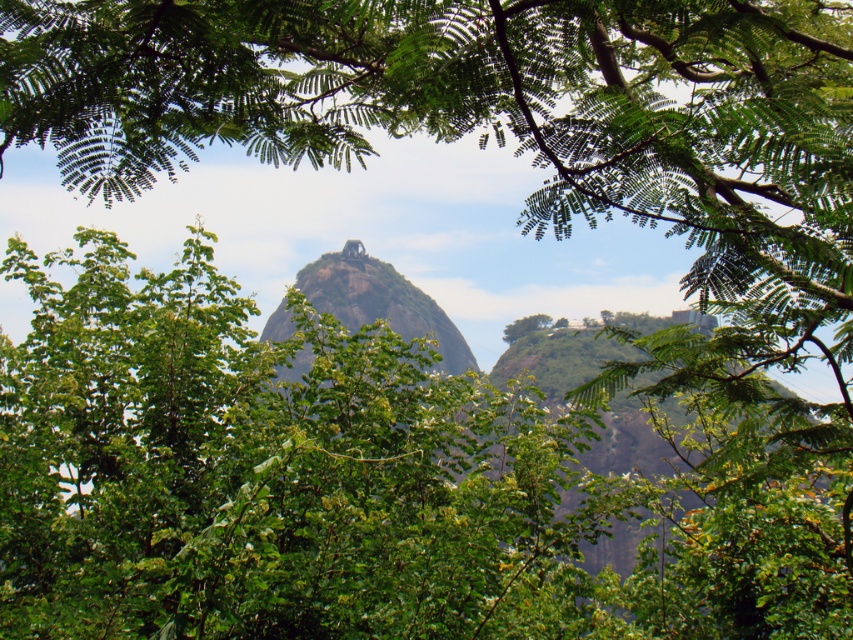
Is green rock formation at center positioned behind green leafy tree at center?

No, green rock formation at center is in front of green leafy tree at center.

Which is behind, point (283, 321) or point (531, 328)?

The point (531, 328) is behind.

Does point (309, 358) come behind point (508, 333)?

No.

Identify the location of green rock formation at center. (380, 301).